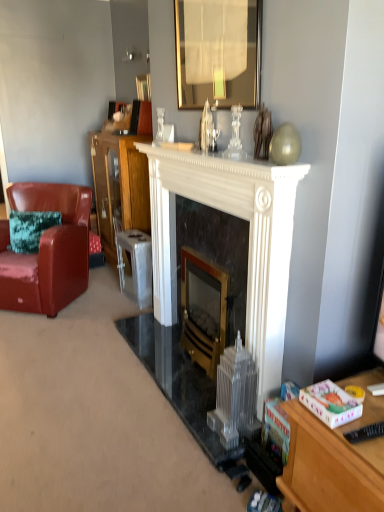
The width and height of the screenshot is (384, 512). Describe the element at coordinates (218, 52) in the screenshot. I see `gold-framed mirror at upper center` at that location.

What do you see at coordinates (168, 133) in the screenshot? I see `glossy ceramic coffee cup at upper center` at bounding box center [168, 133].

The height and width of the screenshot is (512, 384). What do you see at coordinates (248, 241) in the screenshot?
I see `white marble fireplace at center, the 2th fireplace in the right-to-left sequence` at bounding box center [248, 241].

Where is `gold-framed mirror at upper center`? gold-framed mirror at upper center is located at coordinates (218, 52).

From a real-world perspective, which is physically above, white marble fireplace at center or gold-framed mirror at upper center?

gold-framed mirror at upper center.

Is white marble fireplace at center next to gold-framed mirror at upper center?

No, white marble fireplace at center is not making contact with gold-framed mirror at upper center.

Who is shorter, white marble fireplace at center or gold-framed mirror at upper center?

With less height is white marble fireplace at center.

Considering the sizes of objects white marble fireplace at center and gold-framed mirror at upper center in the image provided, who is smaller, white marble fireplace at center or gold-framed mirror at upper center?

gold-framed mirror at upper center.

Relative to metallic silver stool at center, is white marble fireplace at center, the 2th fireplace in the right-to-left sequence, in front or behind?

white marble fireplace at center, the 2th fireplace in the right-to-left sequence, is in front of metallic silver stool at center.

This screenshot has width=384, height=512. I want to click on the 1st fireplace counting from the right of the metallic silver stool at center, so pyautogui.click(x=248, y=241).

Who is bigger, white marble fireplace at center, the 2th fireplace in the right-to-left sequence, or metallic silver stool at center?

white marble fireplace at center, the 2th fireplace in the right-to-left sequence.

Is white marble fireplace at center, the 2th fireplace in the right-to-left sequence, with metallic silver stool at center?

No, white marble fireplace at center, the 2th fireplace in the right-to-left sequence, is not beside metallic silver stool at center.

From the image's perspective, between gold-framed mirror at upper center and white marble fireplace at center, the 2th fireplace in the right-to-left sequence, who is located below?

white marble fireplace at center, the 2th fireplace in the right-to-left sequence, from the image's perspective.

Is gold-framed mirror at upper center closer to camera compared to white marble fireplace at center, acting as the 1th fireplace starting from the left?

No, gold-framed mirror at upper center is further to the viewer.

Considering the sizes of objects gold-framed mirror at upper center and white marble fireplace at center, acting as the 1th fireplace starting from the left, in the image provided, who is bigger, gold-framed mirror at upper center or white marble fireplace at center, acting as the 1th fireplace starting from the left,?

white marble fireplace at center, acting as the 1th fireplace starting from the left, is bigger.

Does gold-framed mirror at upper center appear on the right side of white marble fireplace at center, the 2th fireplace in the right-to-left sequence?

Yes, gold-framed mirror at upper center is to the right of white marble fireplace at center, the 2th fireplace in the right-to-left sequence.

Considering the relative positions of metallic gold picture frame at upper center and white marble fireplace at center, the 2th fireplace in the right-to-left sequence, in the image provided, is metallic gold picture frame at upper center to the left or to the right of white marble fireplace at center, the 2th fireplace in the right-to-left sequence,?

A: From the image, it's evident that metallic gold picture frame at upper center is to the left of white marble fireplace at center, the 2th fireplace in the right-to-left sequence.

Is metallic gold picture frame at upper center not inside white marble fireplace at center, acting as the 1th fireplace starting from the left?

Yes, metallic gold picture frame at upper center is outside of white marble fireplace at center, acting as the 1th fireplace starting from the left.

Is metallic gold picture frame at upper center further to camera compared to white marble fireplace at center, the 2th fireplace in the right-to-left sequence?

Yes.

Between point (140, 99) and point (255, 340), which one is positioned behind?

The point (140, 99) is farther.

Is leather armchair at left shorter than wooden cabinet at center?

Yes.

Considering the relative positions of leather armchair at left and wooden cabinet at center in the image provided, is leather armchair at left to the left of wooden cabinet at center from the viewer's perspective?

Indeed, leather armchair at left is positioned on the left side of wooden cabinet at center.

Can we say leather armchair at left lies outside wooden cabinet at center?

That's correct, leather armchair at left is outside of wooden cabinet at center.

From a real-world perspective, is black plastic remote control at lower right over black marble fireplace at center, the second fireplace from the left?

Yes, from a real-world perspective, black plastic remote control at lower right is on top of black marble fireplace at center, the second fireplace from the left.

Is black plastic remote control at lower right inside or outside of black marble fireplace at center, which is the 1th fireplace in right-to-left order?

black plastic remote control at lower right is outside black marble fireplace at center, which is the 1th fireplace in right-to-left order.

Does black plastic remote control at lower right have a greater height compared to black marble fireplace at center, the second fireplace from the left?

Incorrect, the height of black plastic remote control at lower right is not larger of that of black marble fireplace at center, the second fireplace from the left.

From a real-world perspective, is leather armchair at left below metallic silver stool at center?

Actually, leather armchair at left is physically above metallic silver stool at center in the real world.

Considering their positions, is leather armchair at left located in front of or behind metallic silver stool at center?

Clearly, leather armchair at left is in front of metallic silver stool at center.

Could you tell me if leather armchair at left is facing metallic silver stool at center?

No, leather armchair at left is not oriented towards metallic silver stool at center.

The image size is (384, 512). In order to click on mirror that is behind the white marble fireplace at center in this screenshot , I will do `click(218, 52)`.

This screenshot has width=384, height=512. What are the coordinates of `the 2nd fireplace positioned above the metallic silver stool at center (from a real-world perspective)` in the screenshot? It's located at (248, 241).

Looking at this image, looking at the image, which one is located closer to leather armchair at left, black marble fireplace at center, which is the 1th fireplace in right-to-left order, or metallic silver stool at center?

metallic silver stool at center is positioned closer to the anchor leather armchair at left.

Looking at the image, which one is located closer to black marble fireplace at center, the second fireplace from the left, wooden cabinet at center or glossy ceramic coffee cup at upper center?

glossy ceramic coffee cup at upper center is positioned closer to the anchor black marble fireplace at center, the second fireplace from the left.

Based on their spatial positions, is black marble fireplace at center, which is the 1th fireplace in right-to-left order, or metallic gold picture frame at upper center further from wooden cabinet at center?

black marble fireplace at center, which is the 1th fireplace in right-to-left order.

Consider the image. Looking at the image, which one is located closer to white marble fireplace at center, white marble fireplace at center, acting as the 1th fireplace starting from the left, or black plastic remote control at lower right?

white marble fireplace at center, acting as the 1th fireplace starting from the left.

From the picture: Estimate the real-world distances between objects in this image. Which object is closer to white marble fireplace at center, acting as the 1th fireplace starting from the left, glossy ceramic coffee cup at upper center or wooden cabinet at center?

glossy ceramic coffee cup at upper center is positioned closer to the anchor white marble fireplace at center, acting as the 1th fireplace starting from the left.

Estimate the real-world distances between objects in this image. Which object is closer to black plastic remote control at lower right, metallic gold picture frame at upper center or glossy ceramic coffee cup at upper center?

glossy ceramic coffee cup at upper center is positioned closer to the anchor black plastic remote control at lower right.

From the image, which object appears to be nearer to black marble fireplace at center, which is the 1th fireplace in right-to-left order, black plastic remote control at lower right or metallic silver stool at center?

metallic silver stool at center.

From the image, which object appears to be farther from gold-framed mirror at upper center, leather armchair at left or wooden cabinet at center?

Among the two, leather armchair at left is located further to gold-framed mirror at upper center.

Find the location of a particular element. Image resolution: width=384 pixels, height=512 pixels. mirror located between white marble fireplace at center and metallic gold picture frame at upper center in the depth direction is located at coordinates (218, 52).

Image resolution: width=384 pixels, height=512 pixels. Find the location of `stool between leather armchair at left and black marble fireplace at center, which is the 1th fireplace in right-to-left order, from left to right`. stool between leather armchair at left and black marble fireplace at center, which is the 1th fireplace in right-to-left order, from left to right is located at coordinates (136, 263).

Image resolution: width=384 pixels, height=512 pixels. I want to click on coffee cup between gold-framed mirror at upper center and black marble fireplace at center, the second fireplace from the left, vertically, so click(168, 133).

At what (x,y) coordinates should I click in order to perform the action: click on cabinetry between leather armchair at left and glossy ceramic coffee cup at upper center in the horizontal direction. Please return your answer as a coordinate pair (x, y). Looking at the image, I should click on (119, 185).